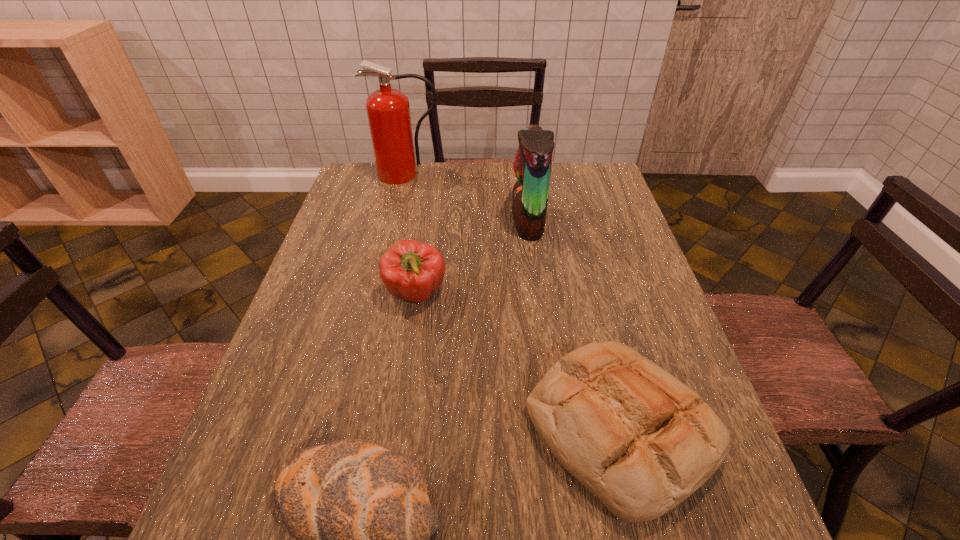
In the image, there is a desktop. Where is `vacant space at the left edge`? This screenshot has width=960, height=540. vacant space at the left edge is located at coordinates (348, 217).

I want to click on vacant space at the right edge of the desktop, so click(x=607, y=217).

Image resolution: width=960 pixels, height=540 pixels. I want to click on vacant space at the far left corner of the desktop, so click(x=357, y=184).

Identify the location of vacant region between the second tallest object and the bell pepper. This screenshot has width=960, height=540. (472, 258).

The height and width of the screenshot is (540, 960). Find the location of `free point between the parrot and the farthest object`. free point between the parrot and the farthest object is located at coordinates (468, 198).

Image resolution: width=960 pixels, height=540 pixels. Identify the location of vacant space that's between the third farthest object and the taller bread. (517, 362).

What are the coordinates of `free space between the tallest object and the bell pepper` in the screenshot? It's located at (411, 234).

This screenshot has height=540, width=960. In order to click on unoccupied area between the fire extinguisher and the bell pepper in this screenshot , I will do `click(411, 234)`.

Identify the location of vacant area that lies between the fourth shortest object and the fire extinguisher. (468, 198).

This screenshot has width=960, height=540. What are the coordinates of `free space between the fire extinguisher and the fourth nearest object` in the screenshot? It's located at (468, 198).